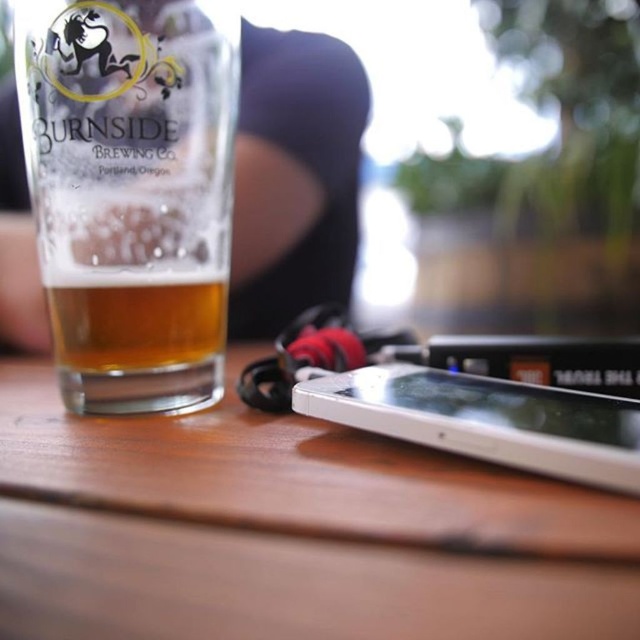
Is wooden table at center above golden glass at center?

Actually, wooden table at center is below golden glass at center.

Find the location of a particular element. The width and height of the screenshot is (640, 640). wooden table at center is located at coordinates (289, 531).

Identify the location of wooden table at center. (289, 531).

Does wooden table at center appear under clear glass beer at left?

Yes, wooden table at center is below clear glass beer at left.

The width and height of the screenshot is (640, 640). Describe the element at coordinates (289, 531) in the screenshot. I see `wooden table at center` at that location.

This screenshot has width=640, height=640. I want to click on wooden table at center, so click(x=289, y=531).

Is white glossy smartphone at lower center bigger than golden glass at center?

Correct, white glossy smartphone at lower center is larger in size than golden glass at center.

Measure the distance from white glossy smartphone at lower center to golden glass at center.

white glossy smartphone at lower center is 5.50 inches from golden glass at center.

The height and width of the screenshot is (640, 640). What are the coordinates of `white glossy smartphone at lower center` in the screenshot? It's located at point(486,419).